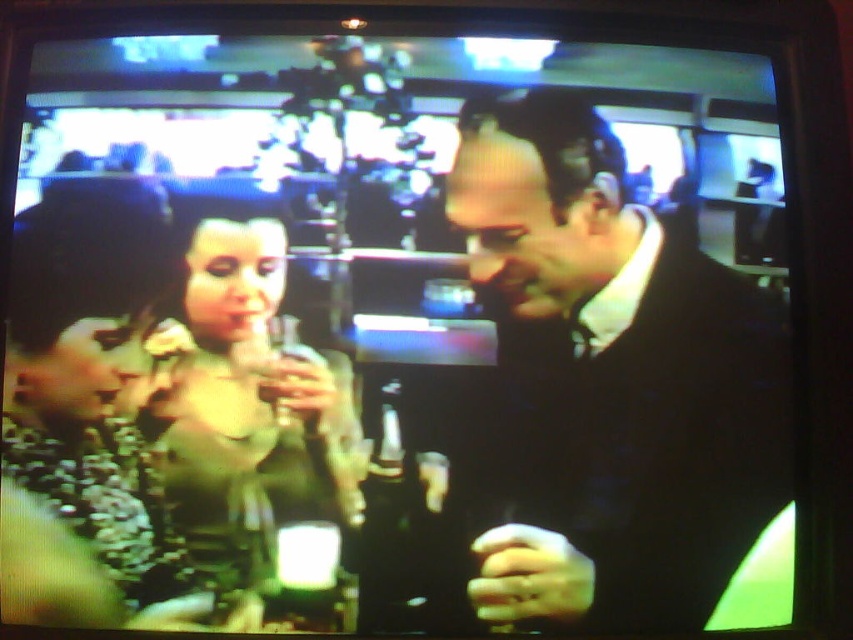
Can you confirm if dark wool suit at center is positioned to the right of translucent glass bottle at center?

Yes, dark wool suit at center is to the right of translucent glass bottle at center.

Can you confirm if dark wool suit at center is positioned above translucent glass bottle at center?

Correct, dark wool suit at center is located above translucent glass bottle at center.

Where is `dark wool suit at center`? This screenshot has height=640, width=853. dark wool suit at center is located at coordinates (613, 380).

Is dark wool suit at center bigger than matte green dress at center?

Yes.

This screenshot has height=640, width=853. What are the coordinates of `dark wool suit at center` in the screenshot? It's located at (613, 380).

I want to click on dark wool suit at center, so click(613, 380).

Which is below, matte green dress at center or translucent glass bottle at center?

translucent glass bottle at center

Does matte green dress at center have a larger size compared to translucent glass bottle at center?

Indeed, matte green dress at center has a larger size compared to translucent glass bottle at center.

Who is more distant from viewer, (181, 397) or (378, 608)?

Point (181, 397)

Find the location of a particular element. This screenshot has width=853, height=640. matte green dress at center is located at coordinates (245, 394).